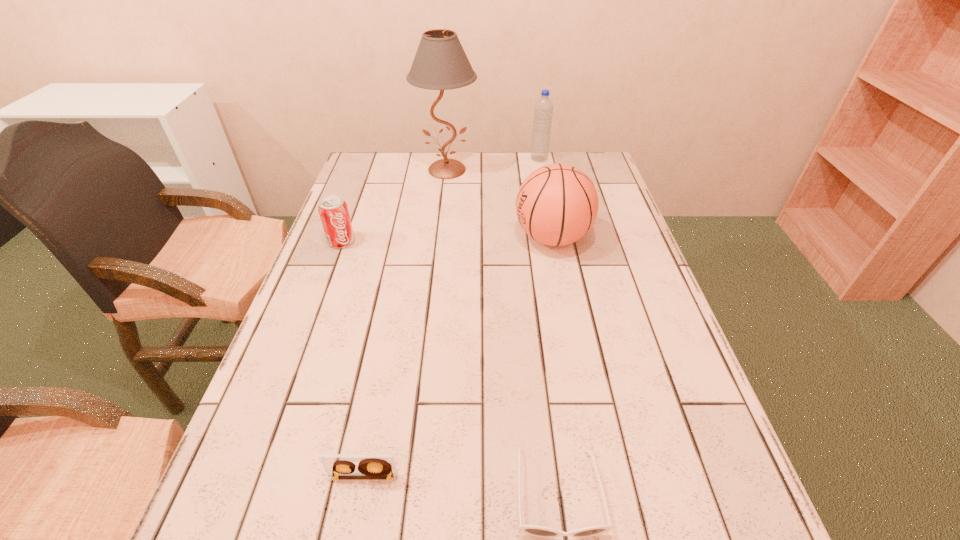
I want to click on free spot at the right edge of the desktop, so click(x=618, y=228).

What are the coordinates of `free space at the far right corner of the desktop` in the screenshot? It's located at (555, 156).

Identify the location of empty space that is in between the tallest object and the basketball. The height and width of the screenshot is (540, 960). (499, 204).

Where is `unoccupied position between the water bottle and the soda can`? unoccupied position between the water bottle and the soda can is located at coordinates (441, 200).

Identify the location of free point between the basketball and the second shortest object. (458, 357).

This screenshot has height=540, width=960. I want to click on vacant point located between the leftmost object and the videotape, so click(x=352, y=360).

I want to click on blank region between the leftmost object and the water bottle, so click(x=441, y=200).

What are the coordinates of `free spot between the basketball and the videotape` in the screenshot? It's located at (458, 357).

Locate an element on the screen. Image resolution: width=960 pixels, height=540 pixels. object that is the second closest to the table lamp is located at coordinates [557, 204].

Identify the location of object that is the third closest to the videotape. (333, 210).